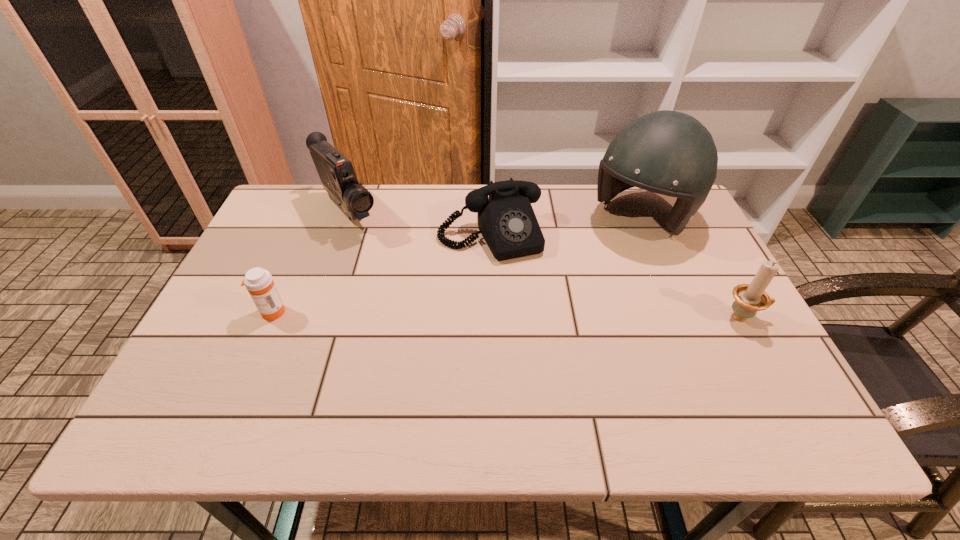
Locate an element on the screen. free space that is in between the football helmet and the candle_holder is located at coordinates (692, 267).

Image resolution: width=960 pixels, height=540 pixels. What are the coordinates of `vacant region between the third object from left to right and the tallest object` in the screenshot? It's located at (565, 227).

The image size is (960, 540). Identify the location of free space between the tallest object and the third object from right to left. (565, 227).

This screenshot has height=540, width=960. I want to click on free point between the football helmet and the medicine, so click(457, 265).

Locate an element on the screen. vacant space that is in between the candle_holder and the telephone is located at coordinates (616, 276).

Image resolution: width=960 pixels, height=540 pixels. In order to click on free spot between the medicine and the camcorder in this screenshot , I will do `click(310, 262)`.

This screenshot has height=540, width=960. What are the coordinates of `unoccupied area between the telephone and the medicine` in the screenshot? It's located at 380,274.

I want to click on vacant area between the camcorder and the third object from right to left, so click(419, 224).

Locate an element on the screen. The image size is (960, 540). blank region between the football helmet and the third object from right to left is located at coordinates (565, 227).

This screenshot has width=960, height=540. I want to click on the fourth closest object relative to the candle_holder, so click(x=259, y=282).